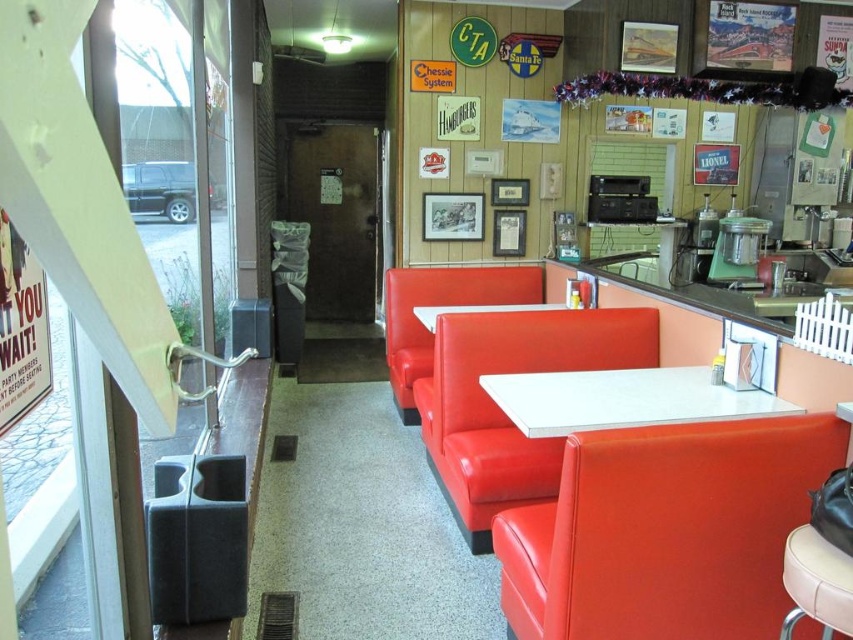
Question: Does white glossy table at center lie behind matte vinyl booth at center?

Choices:
 (A) yes
 (B) no

Answer: (B)

Question: Which object is the closest to the white laminate table at center?

Choices:
 (A) matte vinyl booth at center
 (B) white glossy table at center
 (C) matte red booth at center

Answer: (A)

Question: Does matte vinyl booth at lower right have a larger size compared to white laminate table at center?

Choices:
 (A) yes
 (B) no

Answer: (A)

Question: Which point appears farthest from the camera in this image?

Choices:
 (A) (428, 284)
 (B) (728, 397)

Answer: (A)

Question: Which point is farther from the camera taking this photo?

Choices:
 (A) click(422, 358)
 (B) click(563, 397)
 (C) click(421, 317)

Answer: (A)

Question: Does matte vinyl booth at center appear on the left side of white laminate table at center?

Choices:
 (A) no
 (B) yes

Answer: (B)